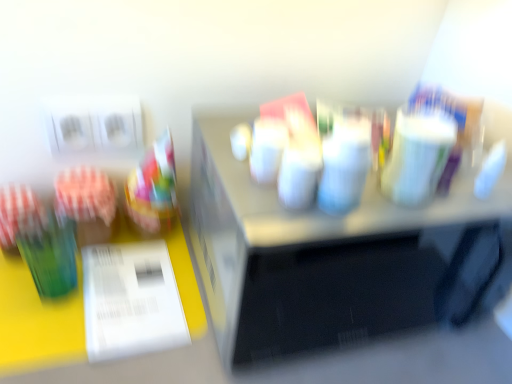
Where is `translucent plastic cup at left`? translucent plastic cup at left is located at coordinates (153, 189).

What do you see at coordinates (345, 276) in the screenshot?
I see `metallic silver microwave at center` at bounding box center [345, 276].

Identify the location of green glass at left. Image resolution: width=512 pixels, height=384 pixels. (86, 203).

Identify the location of translucent plastic cup at left. (153, 189).

Considering the sizes of objects translucent plastic cup at left and white glossy paper at lower left in the image provided, who is bigger, translucent plastic cup at left or white glossy paper at lower left?

With larger size is translucent plastic cup at left.

Is translucent plastic cup at left in front of or behind white glossy paper at lower left in the image?

In the image, translucent plastic cup at left appears behind white glossy paper at lower left.

From the image's perspective, between translucent plastic cup at left and white glossy paper at lower left, who is located below?

From the image's view, white glossy paper at lower left is below.

Identify the location of food behind the white glossy paper at lower left. (153, 189).

Is green glass at left oriented towards translucent plastic cup at left?

No, green glass at left is not facing towards translucent plastic cup at left.

Is green glass at left beside translucent plastic cup at left?

Yes, green glass at left is with translucent plastic cup at left.

Locate an element on the screen. stationery below the translucent plastic cup at left (from a real-world perspective) is located at coordinates [x=86, y=203].

Is green glass at left situated inside translucent plastic cup at left or outside?

The correct answer is: outside.

From a real-world perspective, is white glossy paper at lower left physically below metallic silver microwave at center?

Indeed, from a real-world perspective, white glossy paper at lower left is positioned beneath metallic silver microwave at center.

Can you tell me how much white glossy paper at lower left and metallic silver microwave at center differ in facing direction?

The angle between the facing direction of white glossy paper at lower left and the facing direction of metallic silver microwave at center is 5.61e-05 degrees.

Does white glossy paper at lower left turn towards metallic silver microwave at center?

No.

Which of these two, white glossy paper at lower left or metallic silver microwave at center, is bigger?

With larger size is metallic silver microwave at center.

How many degrees apart are the facing directions of green glass at left and metallic silver microwave at center?

5.5e-05 degrees.

Between green glass at left and metallic silver microwave at center, which one has more height?

Standing taller between the two is metallic silver microwave at center.

In the scene shown: Which of these two, green glass at left or metallic silver microwave at center, is wider?

metallic silver microwave at center is wider.

Which is more to the right, green glass at left or metallic silver microwave at center?

Positioned to the right is metallic silver microwave at center.

Considering the positions of objects metallic silver microwave at center and green glass at left in the image provided, who is in front, metallic silver microwave at center or green glass at left?

metallic silver microwave at center.

Can you tell me how much metallic silver microwave at center and green glass at left differ in facing direction?

5.5e-05 degrees separate the facing orientations of metallic silver microwave at center and green glass at left.

The height and width of the screenshot is (384, 512). I want to click on stationery on the left of metallic silver microwave at center, so click(86, 203).

Consider the image. From the image's perspective, would you say metallic silver microwave at center is shown under green glass at left?

Yes, from the image's perspective, metallic silver microwave at center is below green glass at left.

Find the location of a particular element. stationery below the translucent plastic cup at left (from a real-world perspective) is located at coordinates (86, 203).

How different are the orientations of translucent plastic cup at left and green glass at left in degrees?

The facing directions of translucent plastic cup at left and green glass at left are 0.000257 degrees apart.

From a real-world perspective, is translucent plastic cup at left located beneath green glass at left?

Incorrect, from a real-world perspective, translucent plastic cup at left is higher than green glass at left.

Is translucent plastic cup at left aimed at green glass at left?

No, translucent plastic cup at left does not turn towards green glass at left.

Which of these two, white glossy paper at lower left or green glass at left, is thinner?

With smaller width is green glass at left.

Does white glossy paper at lower left have a greater height compared to green glass at left?

No, white glossy paper at lower left is not taller than green glass at left.

From the image's perspective, is white glossy paper at lower left on green glass at left?

Actually, white glossy paper at lower left appears below green glass at left in the image.

Between white glossy paper at lower left and green glass at left, which one is positioned in front?

white glossy paper at lower left is in front.

Find the location of a particular element. paper directly beneath the translucent plastic cup at left (from a real-world perspective) is located at coordinates (131, 301).

Locate an element on the screen. stationery that is below the translucent plastic cup at left (from the image's perspective) is located at coordinates (86, 203).

When comparing their distances from translucent plastic cup at left, does white glossy paper at lower left or green glass at left seem closer?

green glass at left is positioned closer to the anchor translucent plastic cup at left.

Which object lies further to the anchor point white glossy paper at lower left, metallic silver microwave at center or translucent plastic cup at left?

Based on the image, metallic silver microwave at center appears to be further to white glossy paper at lower left.

When comparing their distances from metallic silver microwave at center, does green glass at left or white glossy paper at lower left seem closer?

The object closer to metallic silver microwave at center is white glossy paper at lower left.

Considering their positions, is green glass at left positioned closer to metallic silver microwave at center than translucent plastic cup at left?

translucent plastic cup at left lies closer to metallic silver microwave at center than the other object.

Looking at this image, from the image, which object appears to be nearer to translucent plastic cup at left, metallic silver microwave at center or white glossy paper at lower left?

Based on the image, white glossy paper at lower left appears to be nearer to translucent plastic cup at left.

In the scene shown: Based on their spatial positions, is translucent plastic cup at left or metallic silver microwave at center further from white glossy paper at lower left?

Among the two, metallic silver microwave at center is located further to white glossy paper at lower left.

Which object lies nearer to the anchor point white glossy paper at lower left, green glass at left or translucent plastic cup at left?

green glass at left lies closer to white glossy paper at lower left than the other object.

When comparing their distances from green glass at left, does white glossy paper at lower left or metallic silver microwave at center seem closer?

white glossy paper at lower left.

Locate an element on the screen. paper located between green glass at left and metallic silver microwave at center in the left-right direction is located at coordinates (131, 301).

Where is `stationery between translucent plastic cup at left and white glossy paper at lower left vertically`? The width and height of the screenshot is (512, 384). stationery between translucent plastic cup at left and white glossy paper at lower left vertically is located at coordinates (86, 203).

The image size is (512, 384). Find the location of `food between green glass at left and metallic silver microwave at center in the horizontal direction`. food between green glass at left and metallic silver microwave at center in the horizontal direction is located at coordinates (153, 189).

Where is `food situated between white glossy paper at lower left and metallic silver microwave at center from left to right`? This screenshot has width=512, height=384. food situated between white glossy paper at lower left and metallic silver microwave at center from left to right is located at coordinates click(153, 189).